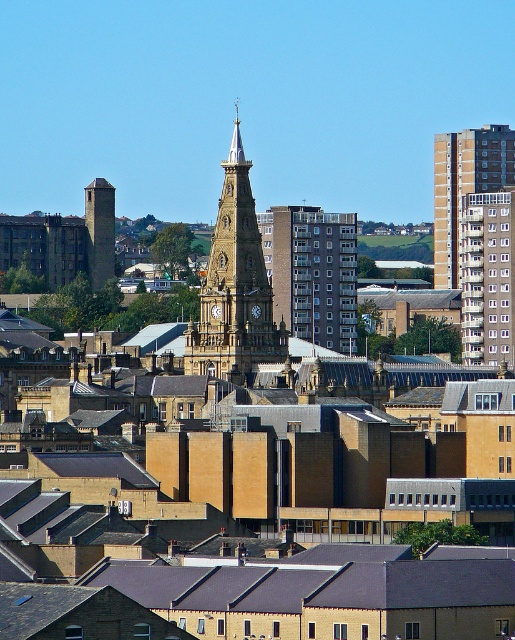
Question: Does golden stone clock tower at center appear over brown concrete building at upper right?

Choices:
 (A) no
 (B) yes

Answer: (A)

Question: Which object is closer to the camera taking this photo?

Choices:
 (A) brown concrete building at upper right
 (B) golden stone clock tower at center

Answer: (B)

Question: Which object appears closest to the camera in this image?

Choices:
 (A) golden stone clock tower at center
 (B) brown concrete building at upper right

Answer: (A)

Question: Does golden stone clock tower at center have a lesser width compared to brown concrete building at upper right?

Choices:
 (A) yes
 (B) no

Answer: (B)

Question: Is golden stone clock tower at center closer to camera compared to brown concrete building at upper right?

Choices:
 (A) yes
 (B) no

Answer: (A)